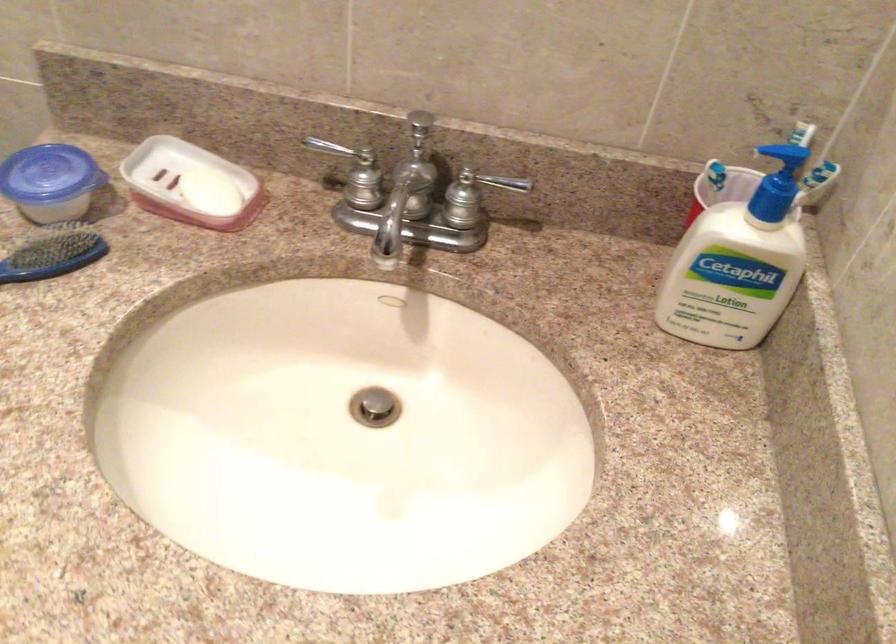
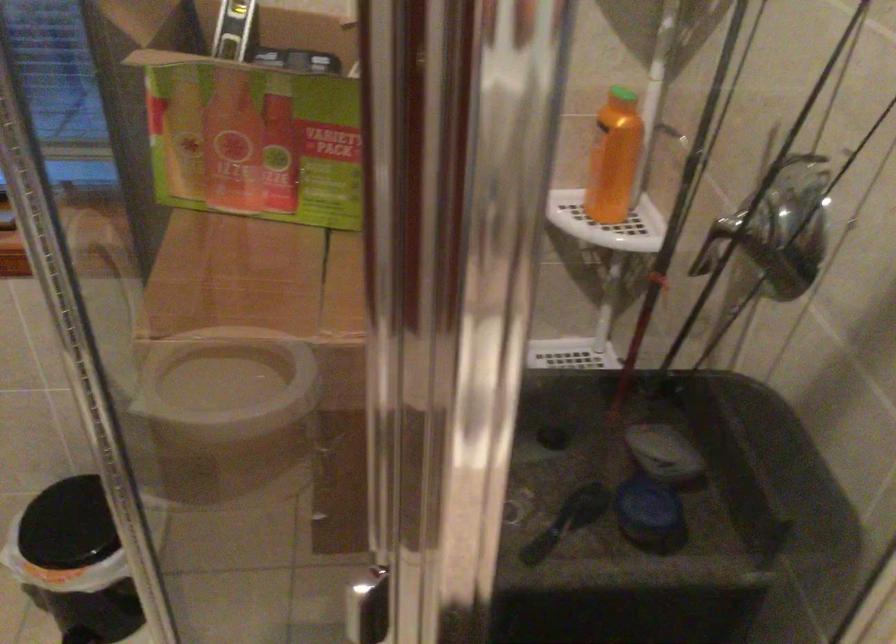
Question: How did the camera likely rotate?

Choices:
 (A) Left
 (B) Right
 (C) Up
 (D) Down

Answer: (A)